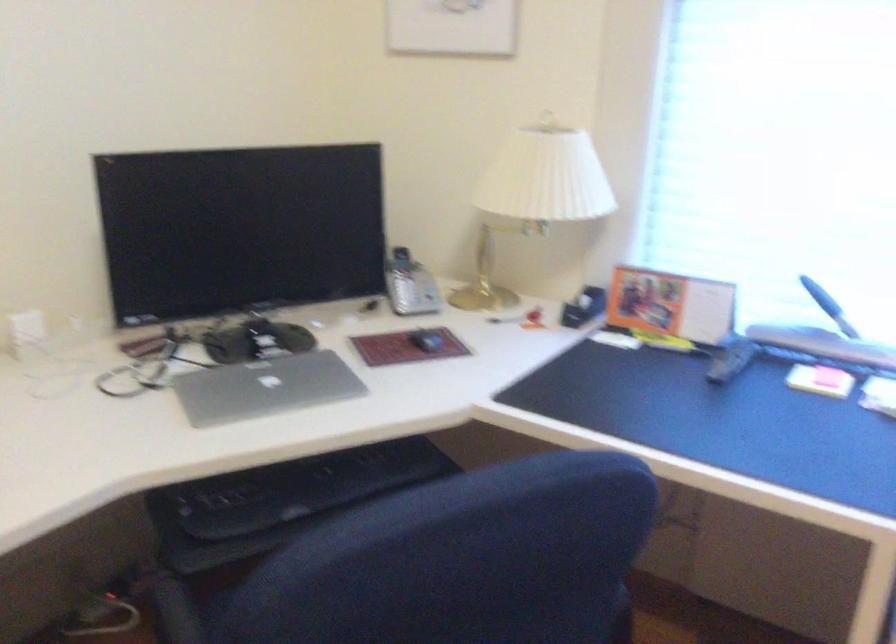
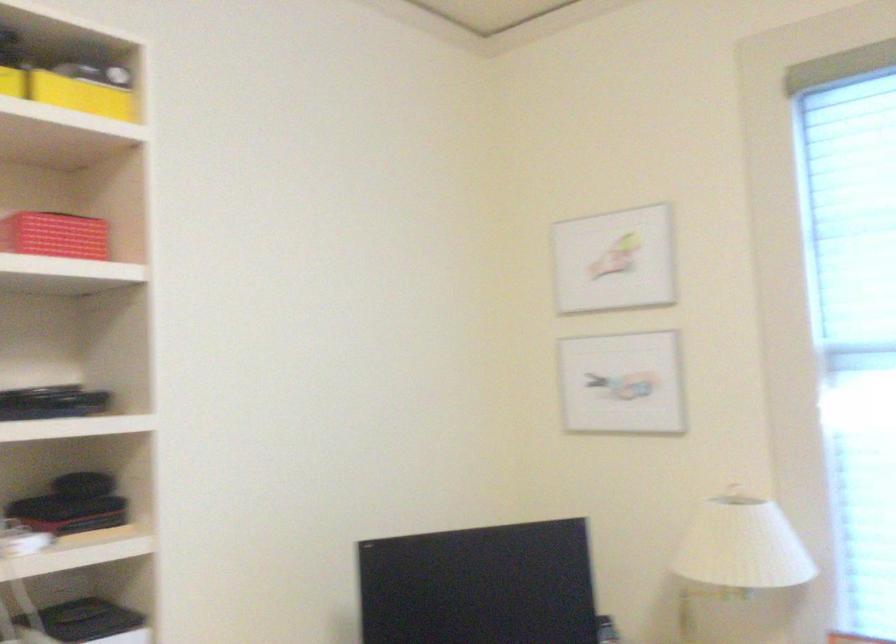
What movement of the cameraman would produce the second image?

The cameraman walked toward left, backward.